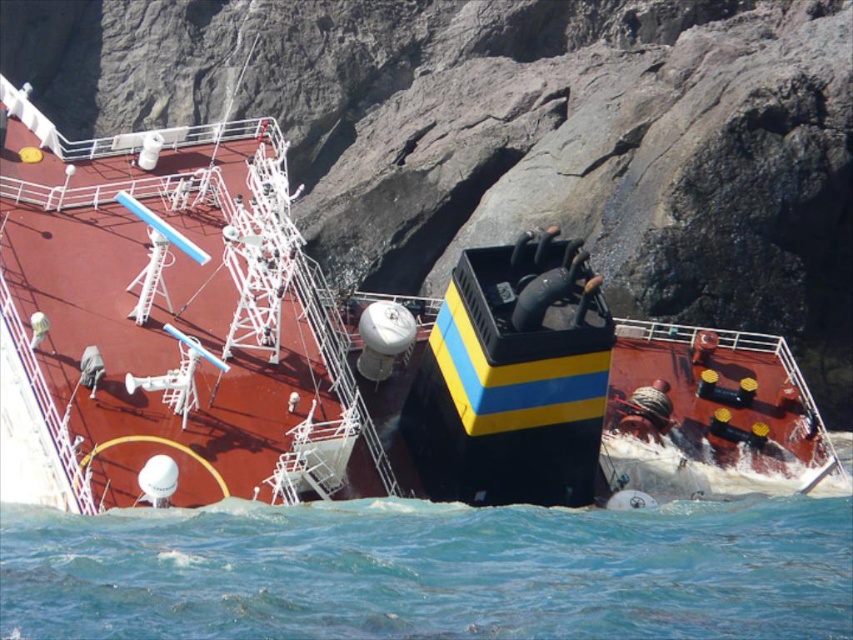
Question: Is shiny black ship at center further to the viewer compared to blue water at lower center?

Choices:
 (A) no
 (B) yes

Answer: (B)

Question: Among these points, which one is nearest to the camera?

Choices:
 (A) (610, 621)
 (B) (616, 429)

Answer: (A)

Question: Is shiny black ship at center to the left of blue water at lower center from the viewer's perspective?

Choices:
 (A) yes
 (B) no

Answer: (A)

Question: Considering the relative positions of shiny black ship at center and blue water at lower center in the image provided, where is shiny black ship at center located with respect to blue water at lower center?

Choices:
 (A) below
 (B) above

Answer: (B)